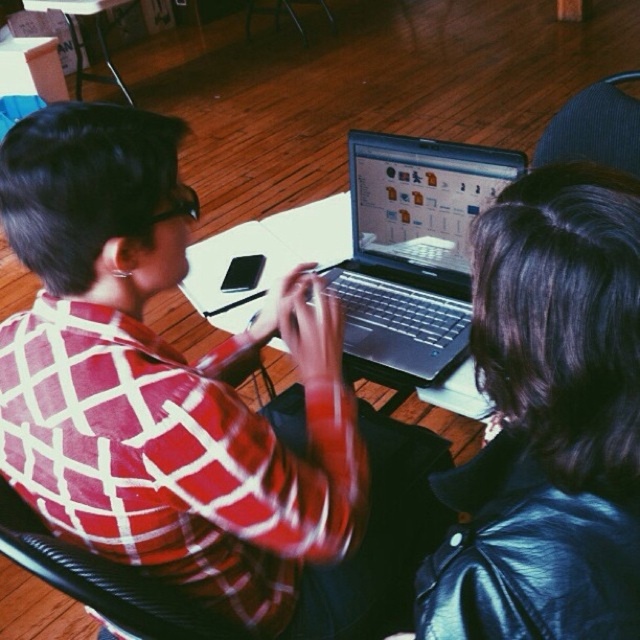
You are a delivery person who needs to place a small package on the table without blocking the black leather jacket at center. The table is represented as a coordinate system where the bottom left corner is the origin point. What is the safest coordinate to place the package?

The safest coordinate to place the package would be at a point away from the black leather jacket at center located at point (548, 420). For example, placing it near the lower left corner of the table, such as at coordinates (64, 64), would ensure it doesn not obstruct the jacket.

You are a photographer standing behind the wooden table. You need to take a photo of the satin silver laptop at center without including the black leather jacket at center in the frame. Is this possible based on their positions?

The black leather jacket at center is below the satin silver laptop at center, so if you position yourself behind the table and aim upwards towards the laptop, you can capture the laptop without the jacket appearing in the frame.

You are a delivery robot with a package that measures 3 feet in length. You need to place the package between the black leather jacket at center and the blue fabric chair at upper right. Is there enough space to fit the package without moving any objects?

The distance between the black leather jacket at center and the blue fabric chair at upper right is 3.72 feet. Since the package is 3 feet long, there is enough space to fit it without moving any objects.